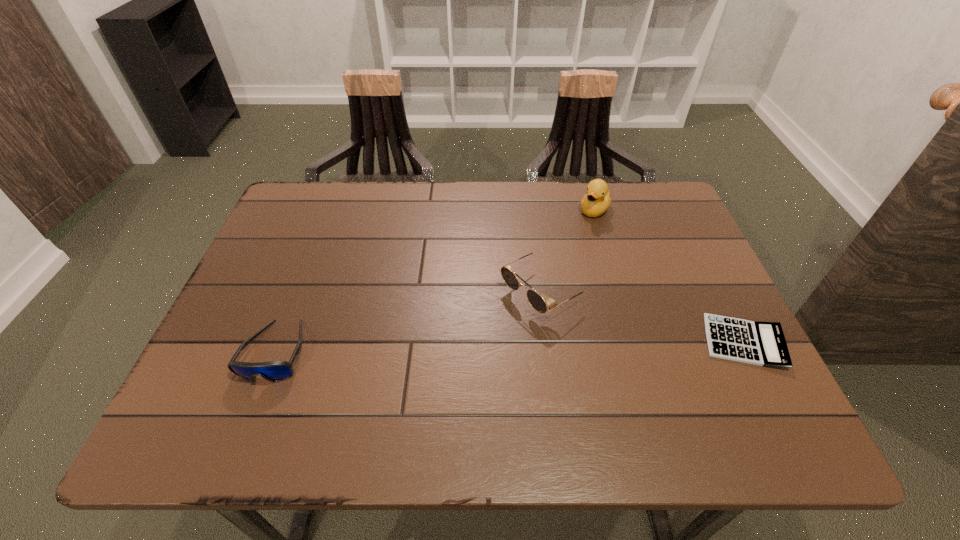
The height and width of the screenshot is (540, 960). Identify the location of vacant position located 0.280m facing forward on the farthest object. (546, 282).

Identify the location of free point located 0.300m facing forward on the farthest object. (542, 287).

You are a GUI agent. You are given a task and a screenshot of the screen. Output one action in this format:
    pyautogui.click(x=<x>, y=<y>)
    Task: Click on the vacant region located 0.310m on the front lenses of the third object from right to left
    
    Given the screenshot: What is the action you would take?
    pyautogui.click(x=392, y=389)

Where is `vacant space located on the front lenses of the third object from right to left`? This screenshot has width=960, height=540. vacant space located on the front lenses of the third object from right to left is located at coordinates (396, 386).

You are a GUI agent. You are given a task and a screenshot of the screen. Output one action in this format:
    pyautogui.click(x=<x>, y=<y>)
    Task: Click on the free spot located 0.080m on the front lenses of the third object from right to left
    
    Given the screenshot: What is the action you would take?
    pyautogui.click(x=482, y=330)

This screenshot has width=960, height=540. I want to click on object that is at the far edge, so click(596, 201).

Where is `sunglasses positioned at the near edge`? sunglasses positioned at the near edge is located at coordinates (274, 371).

Identify the location of calculator present at the near edge. (763, 344).

The width and height of the screenshot is (960, 540). What are the coordinates of `object that is at the left edge` in the screenshot? It's located at (274, 371).

The height and width of the screenshot is (540, 960). Identify the location of object that is at the right edge. (763, 344).